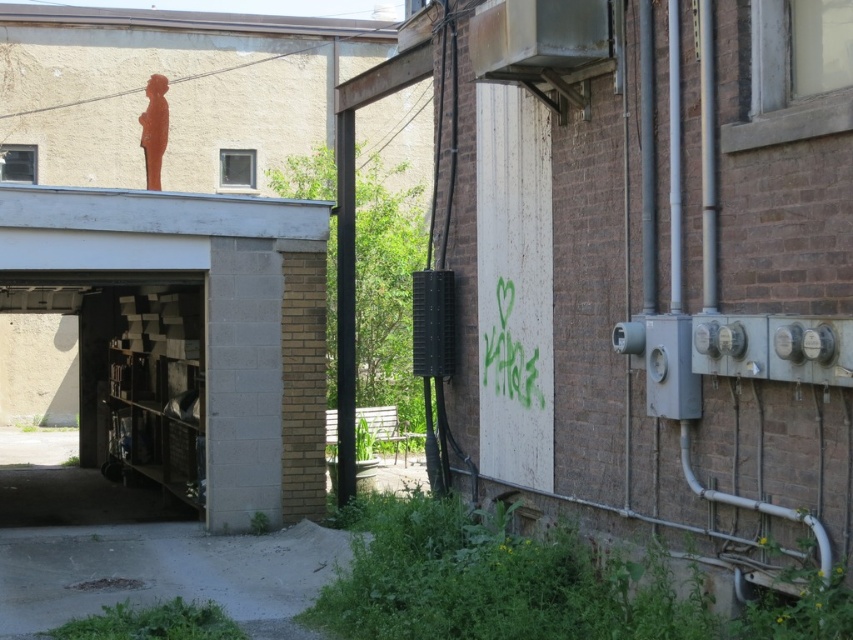
Question: Can you confirm if matte concrete garage at center is positioned to the right of metallic gray shelves at lower left?

Choices:
 (A) yes
 (B) no

Answer: (B)

Question: Observing the image, what is the correct spatial positioning of matte concrete garage at center in reference to metallic gray shelves at lower left?

Choices:
 (A) above
 (B) below

Answer: (A)

Question: Can you confirm if matte concrete garage at center is bigger than metallic gray shelves at lower left?

Choices:
 (A) no
 (B) yes

Answer: (B)

Question: Among these objects, which one is farthest from the camera?

Choices:
 (A) metallic gray shelves at lower left
 (B) matte concrete garage at center

Answer: (A)

Question: Which of the following is the closest to the observer?

Choices:
 (A) (254, 445)
 (B) (177, 291)

Answer: (A)